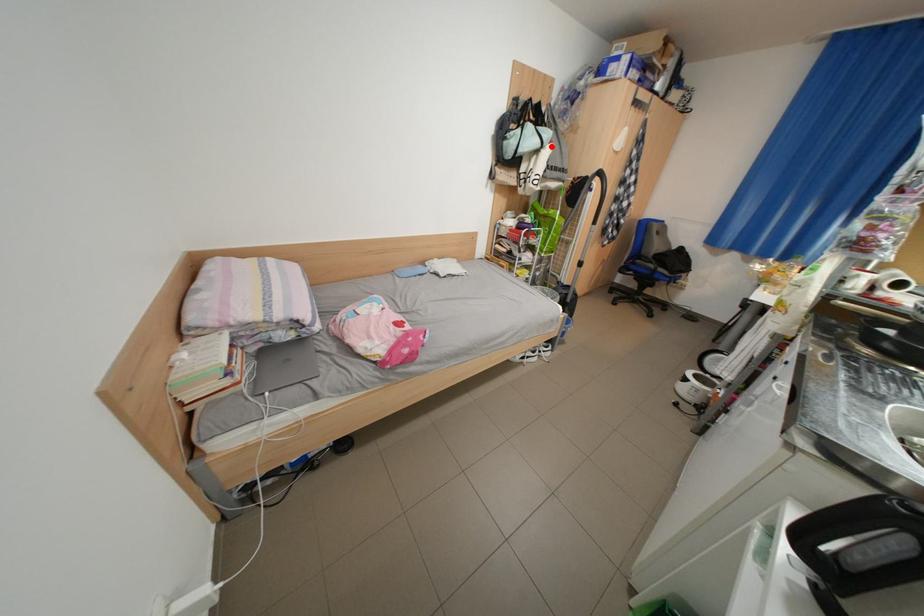
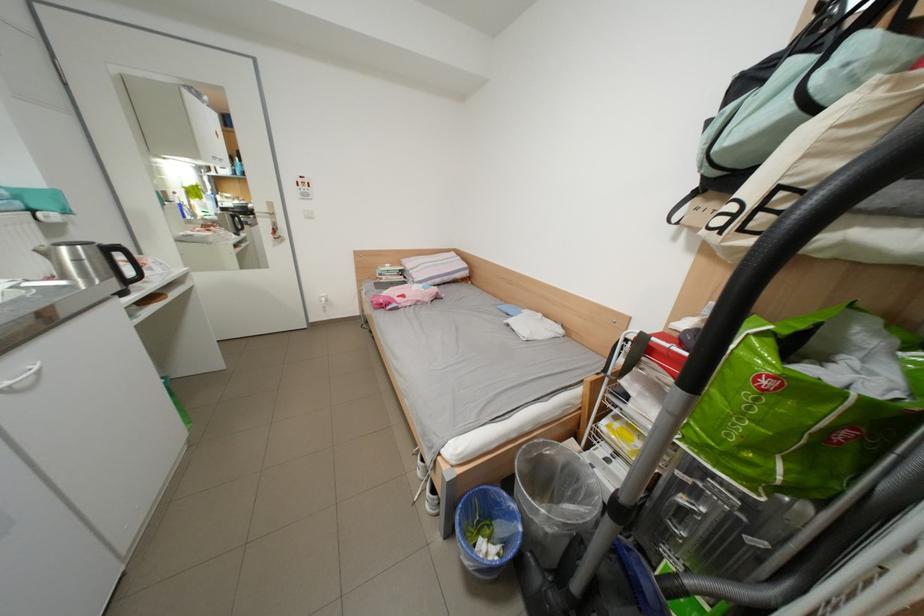
The point at the highlighted location is marked in the first image. Where is the corresponding point in the second image?

(801, 111)